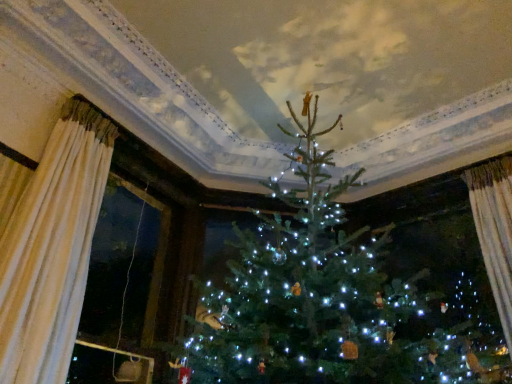
Describe the element at coordinates (52, 248) in the screenshot. I see `white sheer curtain at left` at that location.

You are a GUI agent. You are given a task and a screenshot of the screen. Output one action in this format:
    pyautogui.click(x=<x>, y=<y>)
    Task: Click on the white sheer curtain at left
    Image resolution: width=512 pixels, height=384 pixels.
    Given the screenshot: What is the action you would take?
    [52, 248]

Locate an element on the screen. The image size is (512, 384). white sheer curtain at left is located at coordinates (52, 248).